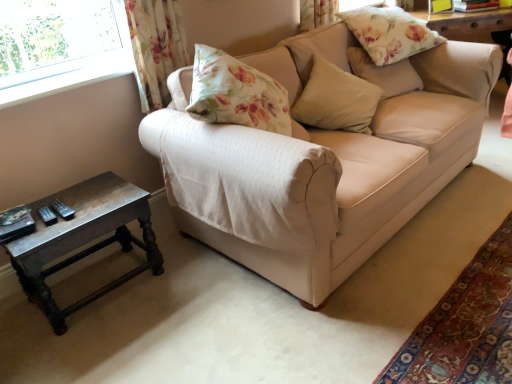
Question: Is floral fabric pillow at upper right, the second pillow when ordered from top to bottom, touching dark brown wooden table at lower left?

Choices:
 (A) yes
 (B) no

Answer: (B)

Question: Is floral fabric pillow at upper right, the second pillow when ordered from top to bottom, at the right side of dark brown wooden table at lower left?

Choices:
 (A) yes
 (B) no

Answer: (A)

Question: From a real-world perspective, is floral fabric pillow at upper right, placed as the second pillow when sorted from bottom to top, over dark brown wooden table at lower left?

Choices:
 (A) no
 (B) yes

Answer: (B)

Question: Is floral fabric pillow at upper right, the second pillow when ordered from top to bottom, positioned behind dark brown wooden table at lower left?

Choices:
 (A) yes
 (B) no

Answer: (A)

Question: From a real-world perspective, is floral fabric pillow at upper right, placed as the second pillow when sorted from bottom to top, located beneath dark brown wooden table at lower left?

Choices:
 (A) no
 (B) yes

Answer: (A)

Question: Is beige fabric couch at center in front of or behind beige fabric pillow at center, which is the third pillow from top to bottom, in the image?

Choices:
 (A) behind
 (B) front

Answer: (B)

Question: From a real-world perspective, relative to beige fabric pillow at center, which is the third pillow from top to bottom, is beige fabric couch at center vertically above or below?

Choices:
 (A) below
 (B) above

Answer: (A)

Question: From their relative heights in the image, would you say beige fabric couch at center is taller or shorter than beige fabric pillow at center, the 1th pillow in the bottom-to-top sequence?

Choices:
 (A) tall
 (B) short

Answer: (A)

Question: From the image's perspective, is beige fabric couch at center positioned above or below beige fabric pillow at center, the 1th pillow in the bottom-to-top sequence?

Choices:
 (A) below
 (B) above

Answer: (A)

Question: Would you say floral fabric curtain at upper left is to the left or to the right of beige fabric pillow at center, which is the third pillow from top to bottom, in the picture?

Choices:
 (A) right
 (B) left

Answer: (B)

Question: In terms of width, does floral fabric curtain at upper left look wider or thinner when compared to beige fabric pillow at center, which is the third pillow from top to bottom?

Choices:
 (A) wide
 (B) thin

Answer: (B)

Question: In terms of height, does floral fabric curtain at upper left look taller or shorter compared to beige fabric pillow at center, which is the third pillow from top to bottom?

Choices:
 (A) tall
 (B) short

Answer: (A)

Question: In the image, is floral fabric curtain at upper left positioned in front of or behind beige fabric pillow at center, the 1th pillow in the bottom-to-top sequence?

Choices:
 (A) front
 (B) behind

Answer: (A)

Question: From a real-world perspective, is beige fabric couch at center above or below floral fabric pillow at upper right, which is the third pillow from bottom to top?

Choices:
 (A) below
 (B) above

Answer: (A)

Question: Is point pos(378,200) closer or farther from the camera than point pos(345,11)?

Choices:
 (A) farther
 (B) closer

Answer: (B)